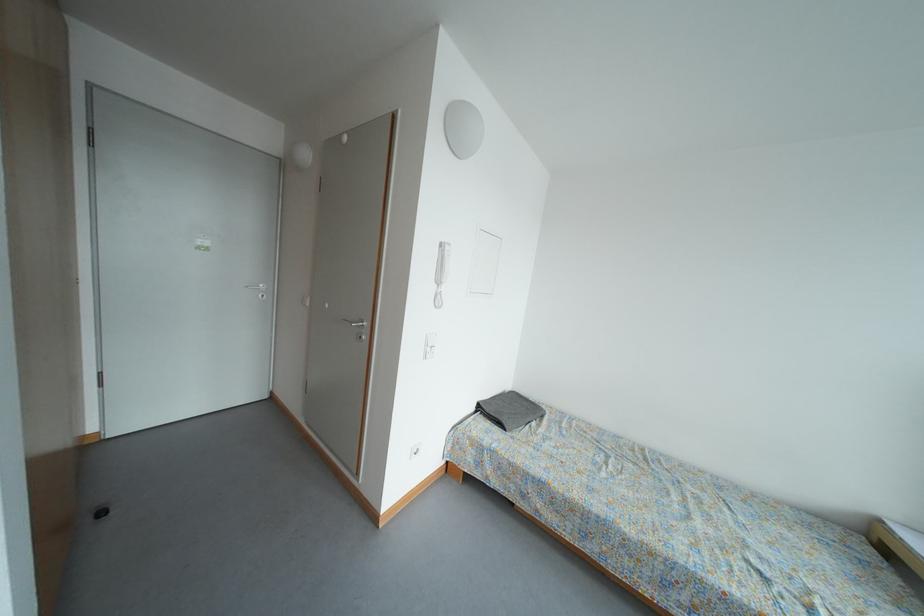
Describe the element at coordinates (441, 272) in the screenshot. I see `a intercom handset` at that location.